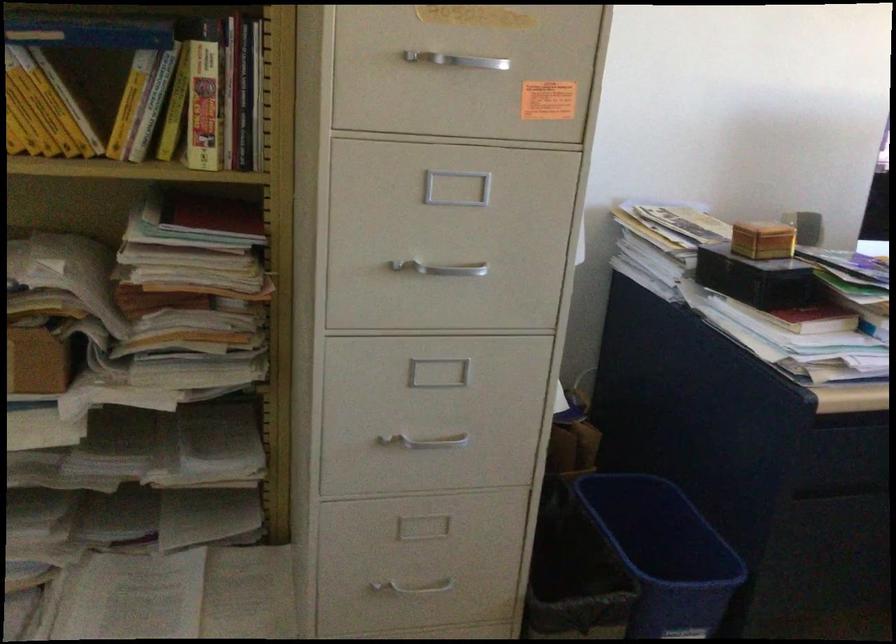
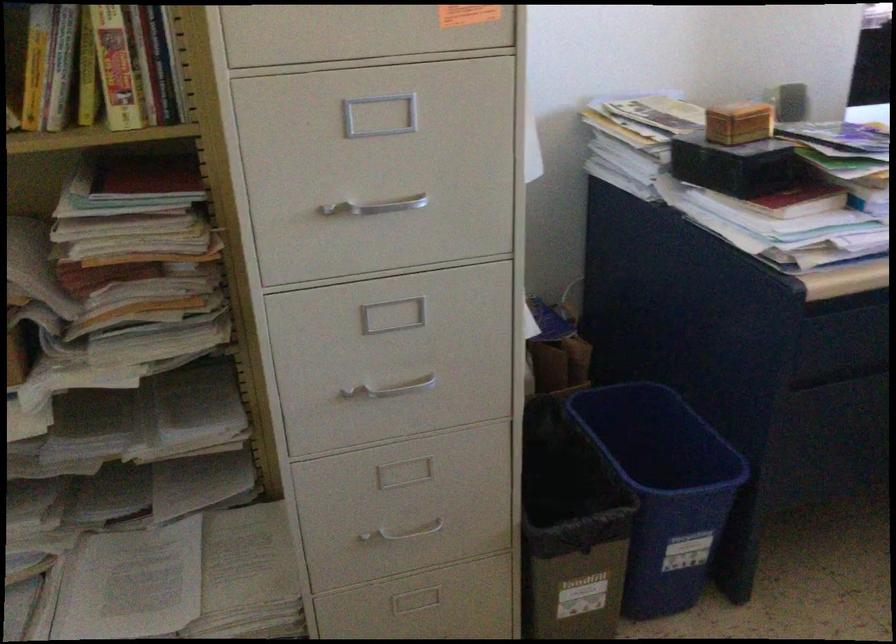
Which direction would the cameraman need to move to produce the second image?

The cameraman moved toward right, forward.